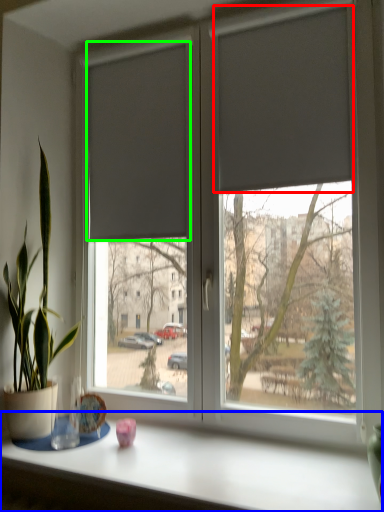
Question: Estimate the real-world distances between objects in this image. Which object is closer to curtain (highlighted by a red box), table (highlighted by a blue box) or curtain (highlighted by a green box)?

Choices:
 (A) table
 (B) curtain

Answer: (B)